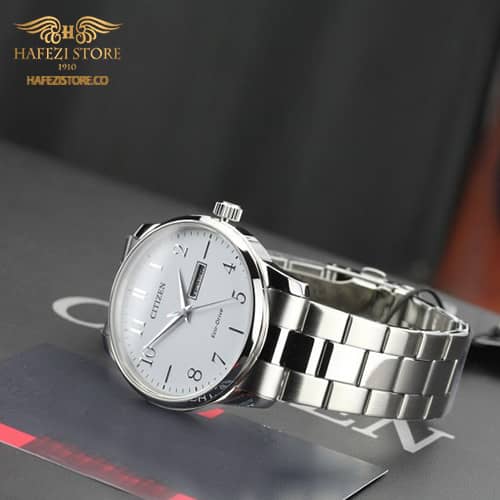
The image size is (500, 500). I want to click on tabletop, so click(x=69, y=215).